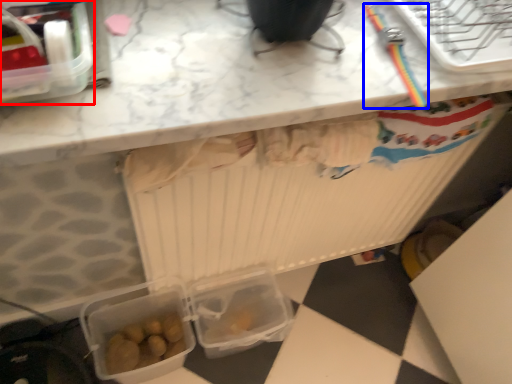
Question: Among these objects, which one is nearest to the camera, lunch box (highlighted by a red box) or tool (highlighted by a blue box)?

Choices:
 (A) lunch box
 (B) tool

Answer: (A)